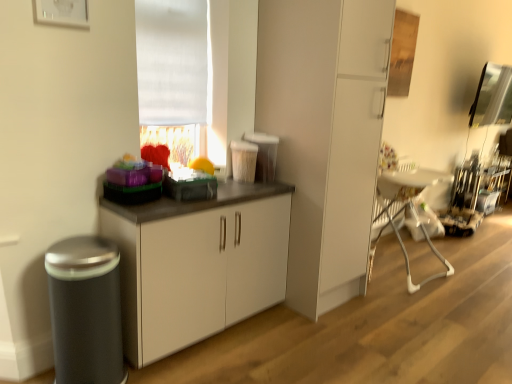
This screenshot has height=384, width=512. I want to click on vacant area that lies in front of white matte cabinet at center, marked as the 1th cabinetry in a right-to-left arrangement, so click(x=327, y=332).